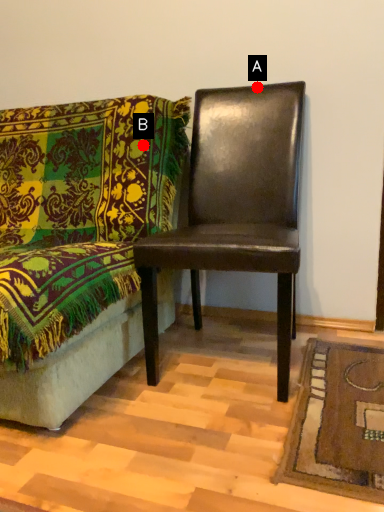
Question: Two points are circled on the image, labeled by A and B beside each circle. Which of the following is the closest to the observer?

Choices:
 (A) A is closer
 (B) B is closer

Answer: (B)